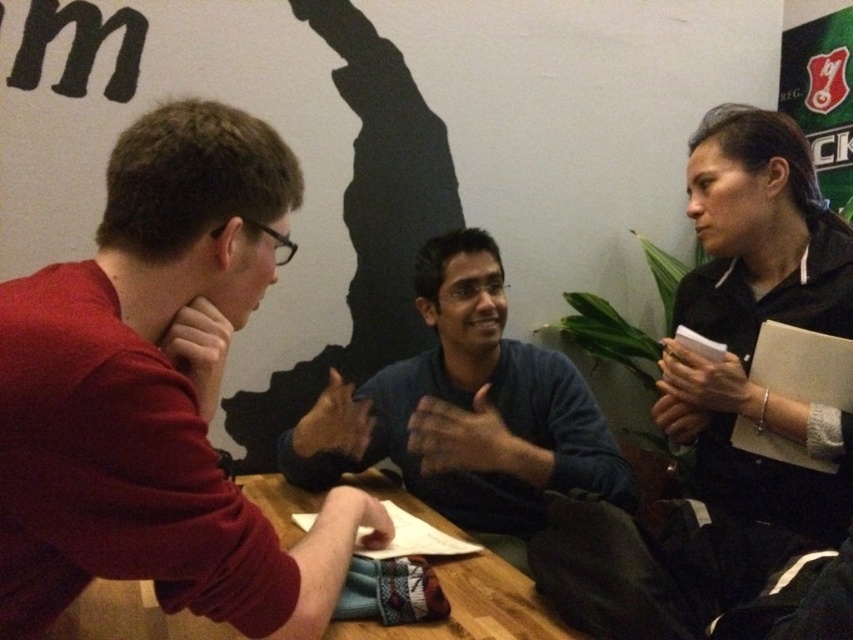
You are standing at the point labeled as point (x=163, y=602) in the image. If you want to take a photo of the three people around the table, will you be able to fit all of them in the frame of a camera that has a 30 inch field of view?

The point labeled as point (x=163, y=602) and the camera are 31.04 inches apart. Since the camera has a 30 inch field of view, you will not be able to fit all three people in the frame.

You are standing in the room and want to hand a document to the person wearing the dark blue sweater at center without disturbing the person in the matte red sweater at left. How should you approach?

Since the matte red sweater at left is in front of the dark blue sweater at center, you should approach from the side opposite to the matte red sweater at left to reach the dark blue sweater at center without obstructing their view or causing disturbance.